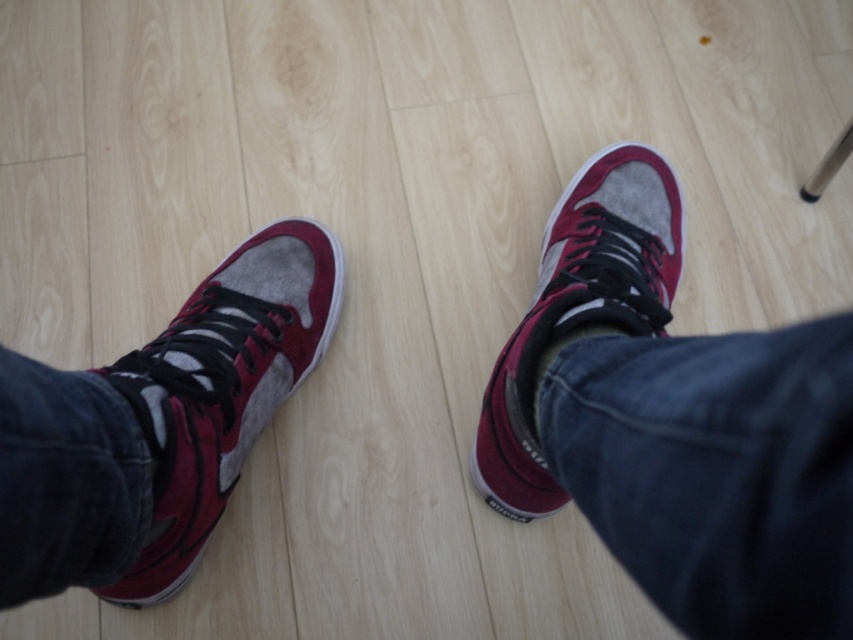
You are trying to locate the matte suede sneaker at right in the image. According to the coordinates provided, where exactly is it positioned?

The matte suede sneaker at right is located at coordinates point (676,422).